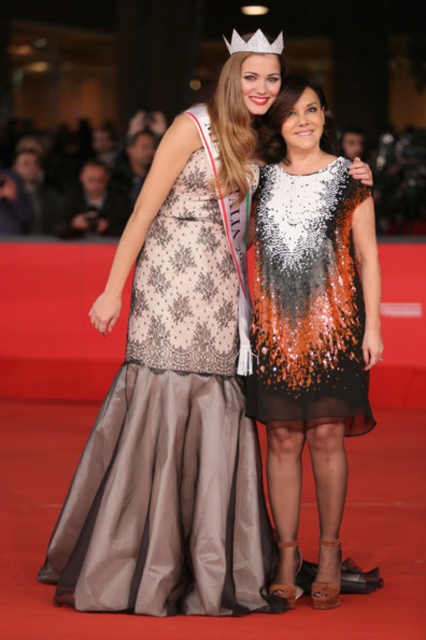
You are standing at the front of the red carpet and want to take a photo of both women. If you position yourself so that the camera is directly facing the point at point (143,163), will the woman at point (262,36) be in front of or behind the other woman in the photo?

The point (143,163) is behind point (262,36), so the woman at point (262,36) will be in front of the other woman in the photo.

You are a photographer at the event and want to ensure both women are in focus. You notice two specific points of interest marked as point 1 at coordinates point (60,176) and point 2 at coordinates point (244,42). Which point is closer to you, the photographer, so you can adjust your lens accordingly?

Point (60,176) is closer to you than point (244,42), so you should focus on that point first to ensure both subjects are in clear view.

You are a photographer at an awards ceremony. You need to position a camera to capture the matte silver gown at center. Where should you aim the camera?

You should aim the camera at point (400,182) to capture the matte silver gown at center.